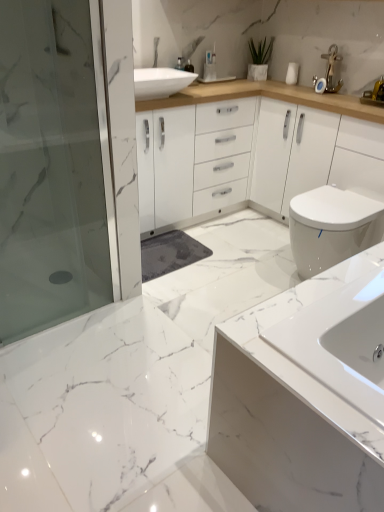
Find the location of a particular element. This screenshot has height=512, width=384. free space to the left of transparent glass shower door at left is located at coordinates (35, 312).